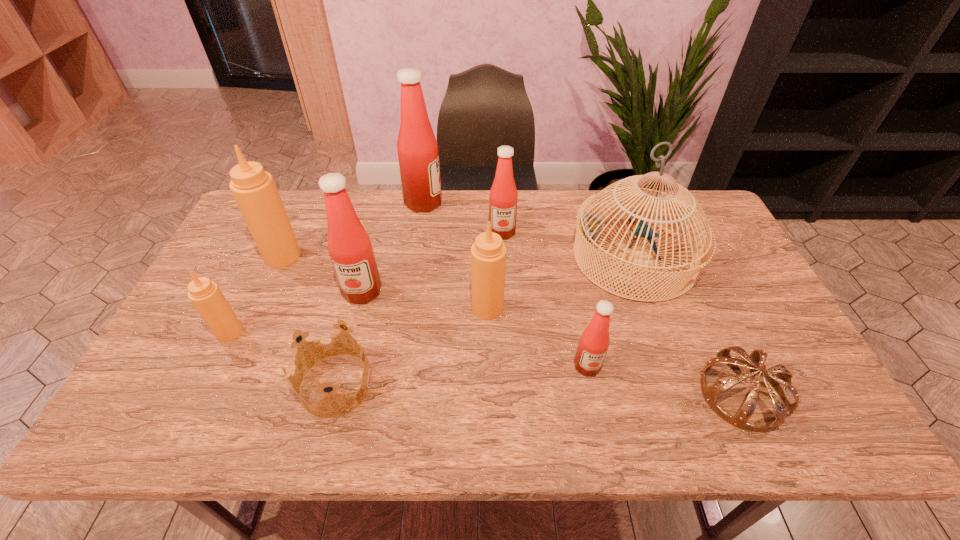
In order to click on the second red condiment from right to left in this screenshot , I will do `click(503, 196)`.

In order to click on the smallest tan condiment in this screenshot , I will do `click(206, 296)`.

In order to click on the fourth nearest object in this screenshot , I will do `click(206, 296)`.

Where is `the nearest red condiment`? The image size is (960, 540). the nearest red condiment is located at coordinates (594, 342).

Identify the location of the rightmost condiment. (594, 342).

Find the location of `crown`. crown is located at coordinates (316, 341).

Find the location of a particular element. tiara is located at coordinates (782, 407).

Find the location of `free region located 0.210m on the front-facing side of the biggest red condiment`. free region located 0.210m on the front-facing side of the biggest red condiment is located at coordinates (502, 203).

What are the coordinates of `vacant space located 0.130m on the back of the farthest tan condiment` in the screenshot? It's located at (300, 218).

The height and width of the screenshot is (540, 960). In order to click on free location located on the front-facing side of the third smallest red condiment in this screenshot , I will do `click(326, 436)`.